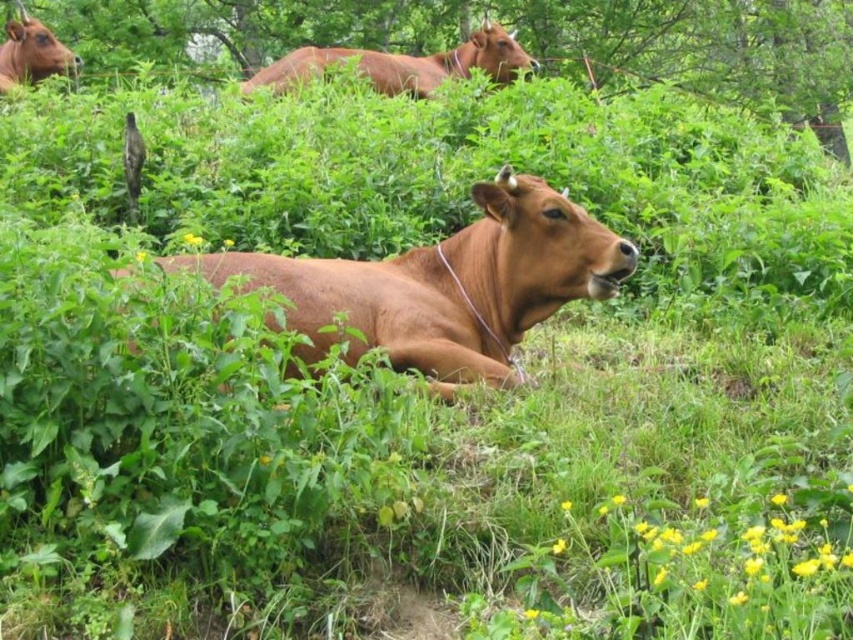
Between brown smooth cow at upper center and matte brown cow at upper left, which one is positioned higher?

matte brown cow at upper left

Can you confirm if brown smooth cow at upper center is taller than matte brown cow at upper left?

Incorrect, brown smooth cow at upper center's height is not larger of matte brown cow at upper left's.

Does point (491, 70) lie behind point (12, 26)?

That is True.

The width and height of the screenshot is (853, 640). I want to click on brown smooth cow at upper center, so click(405, 64).

Who is more forward, (x=822, y=13) or (x=369, y=330)?

Point (x=369, y=330)

Can you confirm if green leafy tree at upper center is wider than brown matte cow at center?

No, green leafy tree at upper center is not wider than brown matte cow at center.

Between point (161, 28) and point (419, 268), which one is positioned behind?

The point (161, 28) is behind.

At what (x,y) coordinates should I click in order to perform the action: click on green leafy tree at upper center. Please return your answer as a coordinate pair (x, y). The width and height of the screenshot is (853, 640). Looking at the image, I should click on (518, 38).

Based on the photo, does green leafy tree at upper center have a greater width compared to brown smooth cow at upper center?

No.

Does point (524, 44) come farther from viewer compared to point (506, 81)?

Yes, point (524, 44) is behind point (506, 81).

This screenshot has width=853, height=640. Find the location of `green leafy tree at upper center`. green leafy tree at upper center is located at coordinates (518, 38).